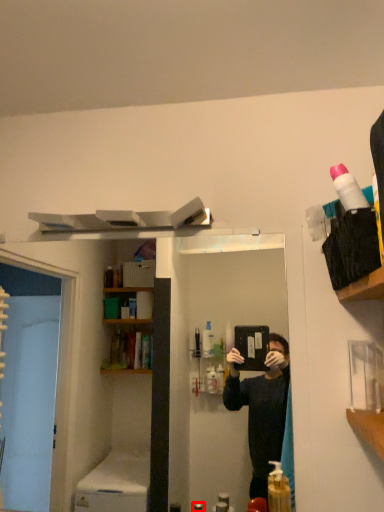
Question: Observing the image, what is the correct spatial positioning of toiletry (annotated by the red box) in reference to cleaning product?

Choices:
 (A) right
 (B) left

Answer: (B)